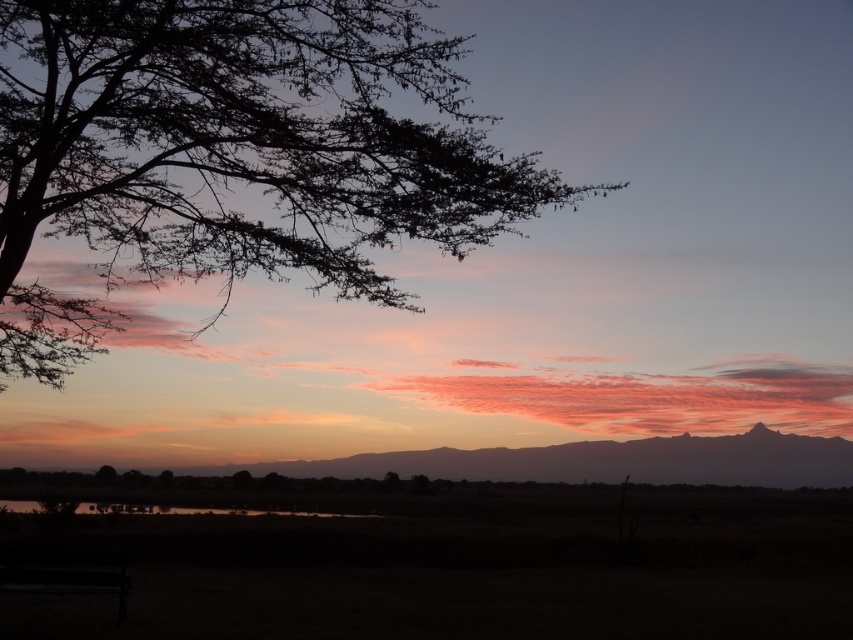
Question: Does silhouette leafy tree at upper left appear over silky purple sky at center?

Choices:
 (A) yes
 (B) no

Answer: (A)

Question: Estimate the real-world distances between objects in this image. Which object is farther from the silky purple sky at center?

Choices:
 (A) silhouette leafy tree at upper left
 (B) smooth water at lower center

Answer: (A)

Question: Which object is farther from the camera taking this photo?

Choices:
 (A) silhouette leafy tree at upper left
 (B) silky purple sky at center

Answer: (B)

Question: Which of the following is the farthest from the observer?

Choices:
 (A) (444, 456)
 (B) (126, 513)

Answer: (A)

Question: Is silhouette leafy tree at upper left smaller than smooth water at lower center?

Choices:
 (A) yes
 (B) no

Answer: (B)

Question: Is silky purple sky at center bigger than smooth water at lower center?

Choices:
 (A) yes
 (B) no

Answer: (A)